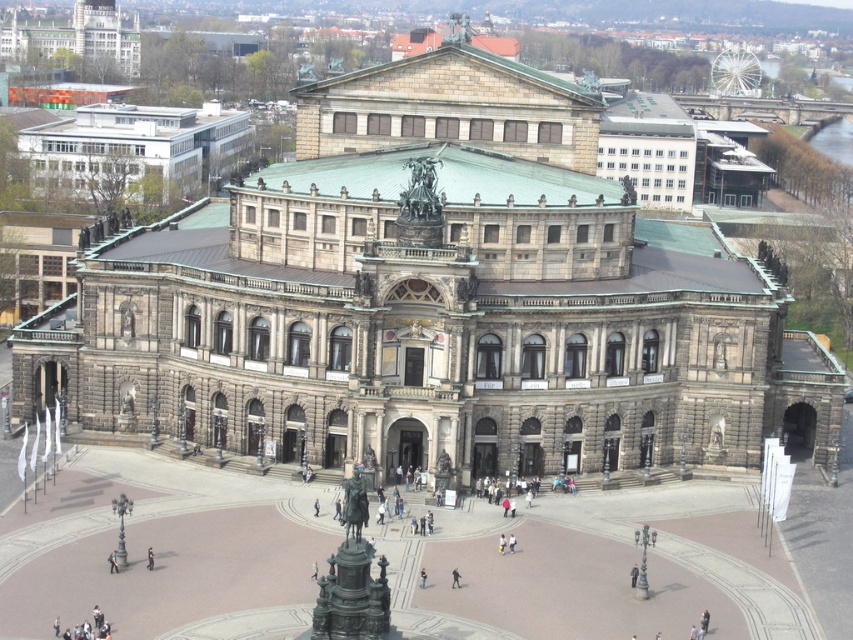
You are a photographer standing in front of the historic building. You want to take a photo that includes both the dark gray fabric jacket at center and the black fabric person at center. Which object should you focus on first to ensure both are in frame?

You should focus on the black fabric person at center first because the dark gray fabric jacket at center is smaller than the black fabric person at center, so ensuring the larger object is centered will allow the smaller one to fit into the frame more easily.

You are standing in front of the historic building and want to walk towards the two points marked in the plaza. Which point, point (456,573) or point (148,554), will you reach first?

You will reach point (456,573) first because it is closer to you than point (148,554).